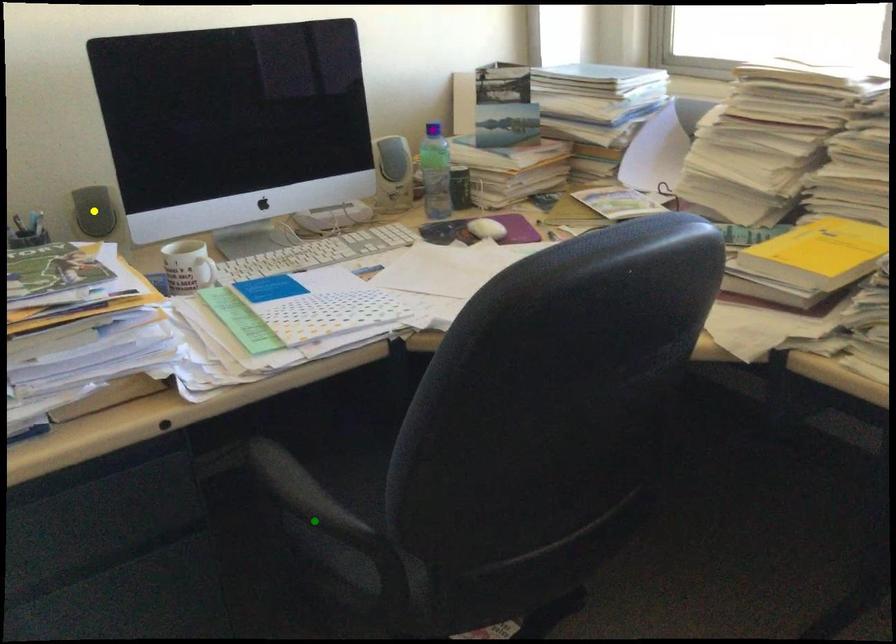
Order these from nearest to farthest:
A) green point
B) yellow point
C) purple point

green point
yellow point
purple point